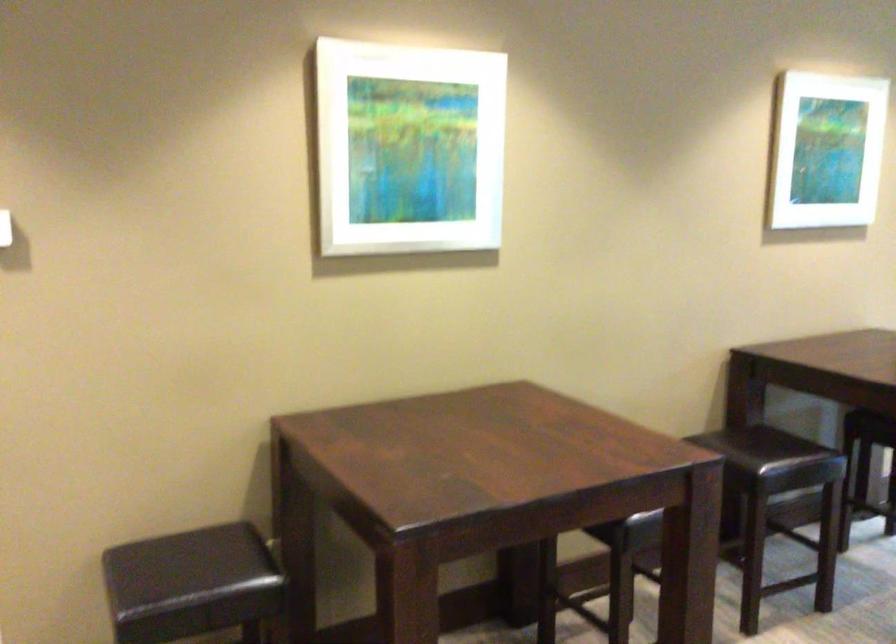
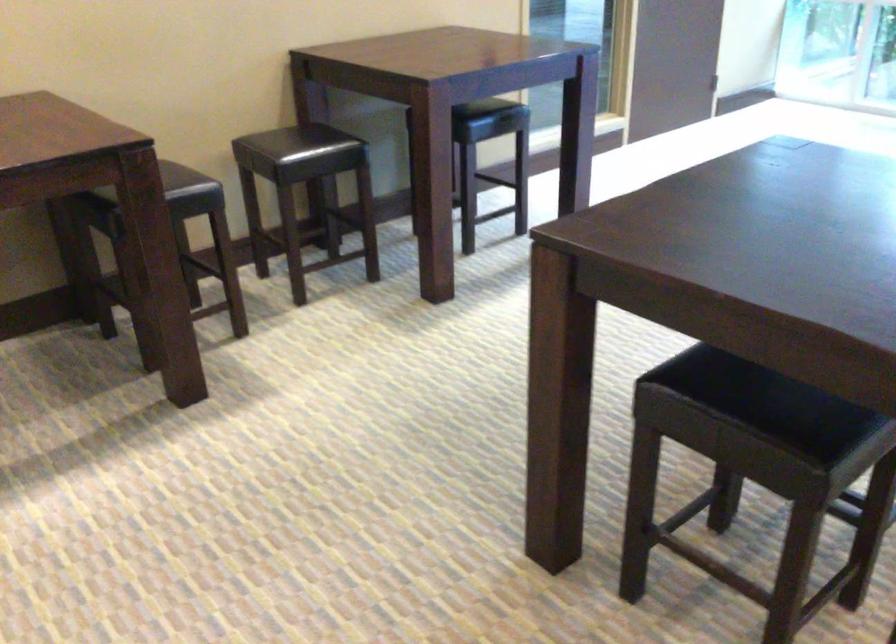
The point at (690,504) is marked in the first image. Where is the corresponding point in the second image?

(168, 182)